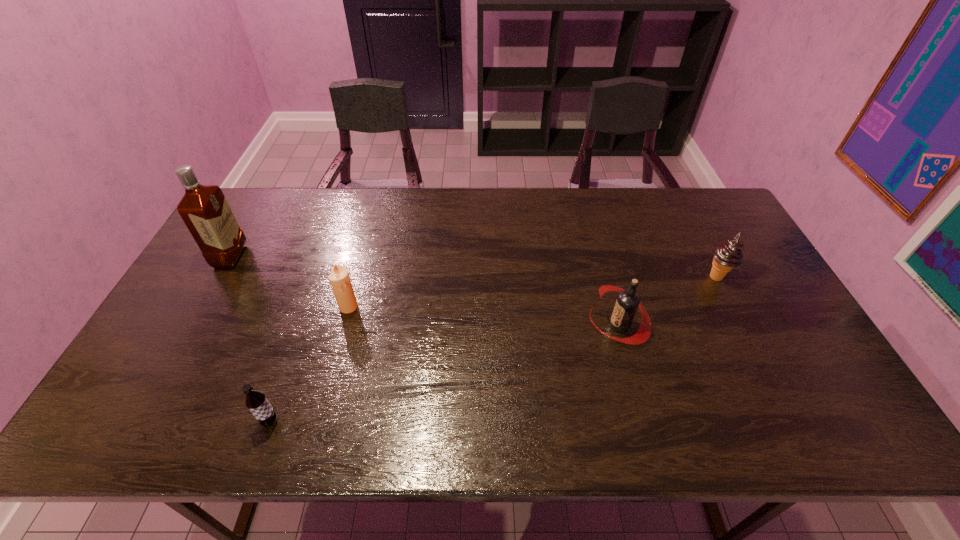
This screenshot has width=960, height=540. I want to click on blank space located on the label of the second object from right to left, so click(x=520, y=325).

The image size is (960, 540). Identify the location of free point located 0.230m on the label of the second object from right to left. (505, 325).

The image size is (960, 540). In order to click on free space located 0.290m on the left of the third object from right to left in this screenshot , I will do `click(235, 307)`.

The height and width of the screenshot is (540, 960). I want to click on free space located 0.400m on the left of the rightmost object, so click(x=569, y=277).

Image resolution: width=960 pixels, height=540 pixels. In order to click on vacant point located on the left of the nearer root beer in this screenshot , I will do `click(120, 421)`.

Image resolution: width=960 pixels, height=540 pixels. Identify the location of object that is at the near edge. point(255,401).

This screenshot has height=540, width=960. I want to click on object that is at the left edge, so click(204, 209).

What are the coordinates of `object located in the right edge section of the desktop` in the screenshot? It's located at (728, 255).

The image size is (960, 540). Identify the location of vacant space at the far edge of the desktop. (332, 212).

Locate an element on the screen. The width and height of the screenshot is (960, 540). free spot at the near edge of the desktop is located at coordinates (664, 418).